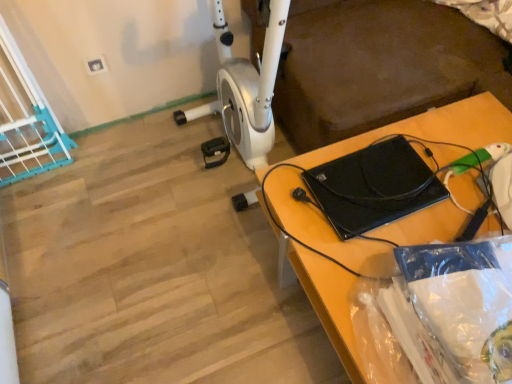
The width and height of the screenshot is (512, 384). I want to click on vacant space situated on the left part of black matte laptop at right, so click(190, 283).